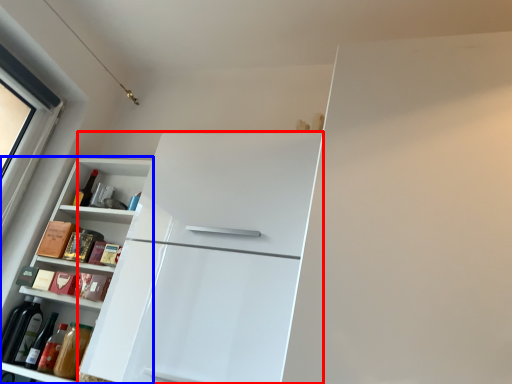
Question: Which of the following is the closest to the observer, refrigerator (highlighted by a red box) or cabinetry (highlighted by a blue box)?

Choices:
 (A) refrigerator
 (B) cabinetry

Answer: (A)